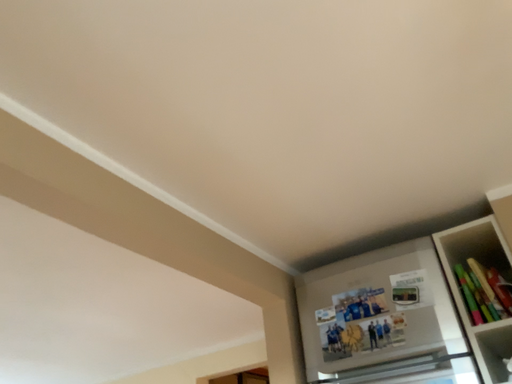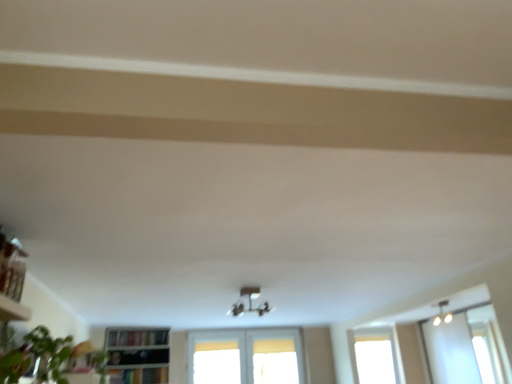
Question: Which way did the camera rotate in the video?

Choices:
 (A) rotated right
 (B) rotated left

Answer: (B)